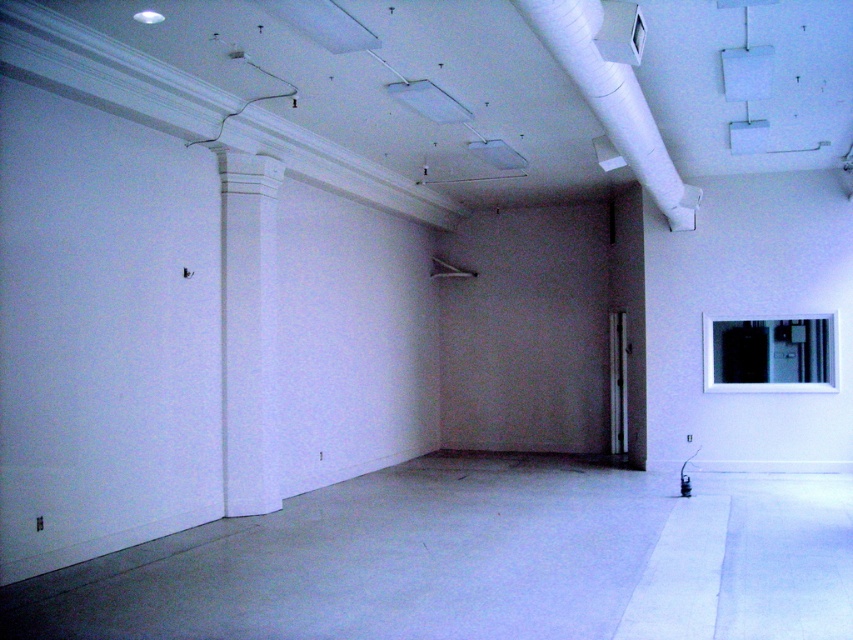
Is white smooth column at left to the right of white matte pipe at upper center from the viewer's perspective?

Incorrect, white smooth column at left is not on the right side of white matte pipe at upper center.

Does white smooth column at left appear over white matte pipe at upper center?

No, white smooth column at left is not above white matte pipe at upper center.

This screenshot has width=853, height=640. Find the location of `white smooth column at left`. white smooth column at left is located at coordinates (248, 330).